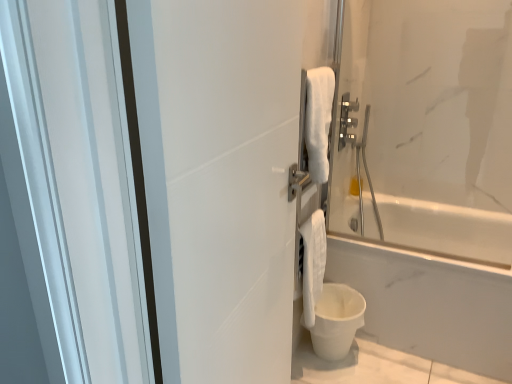
Question: Can you confirm if white matte screen door at center is wider than satin nickel towel bar at upper right?

Choices:
 (A) yes
 (B) no

Answer: (A)

Question: Considering the relative sizes of white matte screen door at center and satin nickel towel bar at upper right in the image provided, is white matte screen door at center shorter than satin nickel towel bar at upper right?

Choices:
 (A) no
 (B) yes

Answer: (A)

Question: From a real-world perspective, is white matte screen door at center physically above satin nickel towel bar at upper right?

Choices:
 (A) yes
 (B) no

Answer: (B)

Question: Is white matte screen door at center to the right of satin nickel towel bar at upper right from the viewer's perspective?

Choices:
 (A) yes
 (B) no

Answer: (B)

Question: From a real-world perspective, does white matte screen door at center sit lower than satin nickel towel bar at upper right?

Choices:
 (A) no
 (B) yes

Answer: (B)

Question: Is white matte screen door at center outside satin nickel towel bar at upper right?

Choices:
 (A) yes
 (B) no

Answer: (A)

Question: Can you confirm if white matte screen door at center is positioned to the right of white soft towel at lower right?

Choices:
 (A) no
 (B) yes

Answer: (A)

Question: Is white matte screen door at center bigger than white soft towel at lower right?

Choices:
 (A) no
 (B) yes

Answer: (B)

Question: Would you say white matte screen door at center is outside white soft towel at lower right?

Choices:
 (A) yes
 (B) no

Answer: (A)

Question: Considering the relative positions of white matte screen door at center and white soft towel at lower right in the image provided, is white matte screen door at center in front of white soft towel at lower right?

Choices:
 (A) no
 (B) yes

Answer: (B)

Question: From the image's perspective, does white matte screen door at center appear higher than white soft towel at lower right?

Choices:
 (A) no
 (B) yes

Answer: (B)

Question: Does white matte screen door at center have a greater height compared to white soft towel at lower right?

Choices:
 (A) no
 (B) yes

Answer: (B)

Question: Is the depth of white matte screen door at center less than that of white matte bucket at lower right?

Choices:
 (A) yes
 (B) no

Answer: (A)